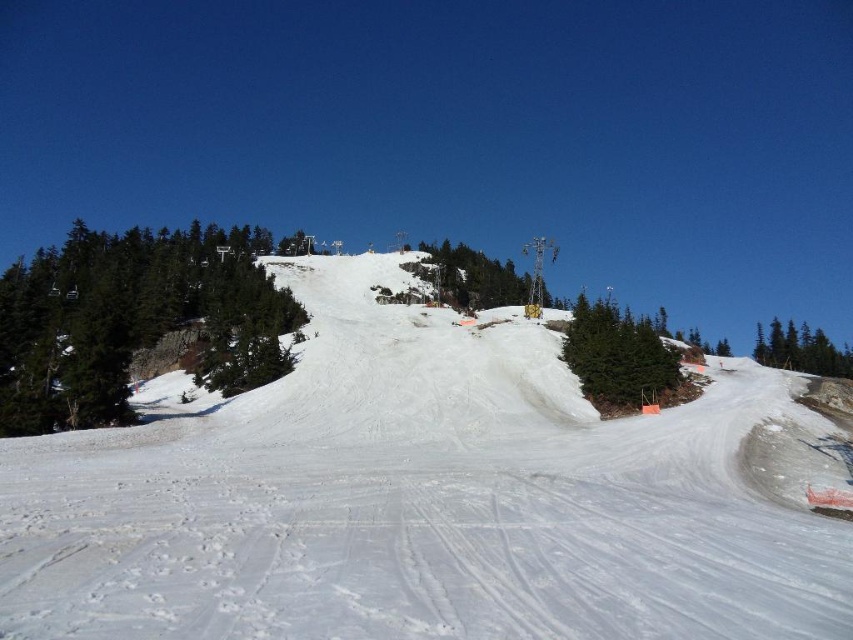
You are a drone operator trying to capture a photo of the white powdery snow at center. The camera is currently positioned at point 0.778, 0.501. To avoid the dense clusters of evergreen trees in the background, should you adjust the camera position to the left or right?

The white powdery snow at center is located at point (426, 497). Since the dense clusters of evergreen trees are in the middle ground surrounding the large snow mound, adjusting the camera position to the left would likely avoid them better than moving right, which might still face the trees.

You are a skier planning to jump off the snow mound in the middle ground. You see the green matte tree at center and the yellow metallic tower at center. Which object is closer to your jump takeoff point?

The green matte tree at center is 206.83 meters away from the yellow metallic tower at center. Since the question asks which is closer to the jump takeoff point, but the description only provides the distance between them, we cannot determine which is closer to the takeoff point without additional information about their positions relative to the jump.

You are a skier planning to take a photo of the ski slope. You want to capture both the point at coordinate point (x=437, y=509) and the point at coordinate point (x=782, y=355) in your shot. Which point will appear larger in the photo?

Point (x=437, y=509) is closer to the camera than point (x=782, y=355), so it will appear larger in the photo.